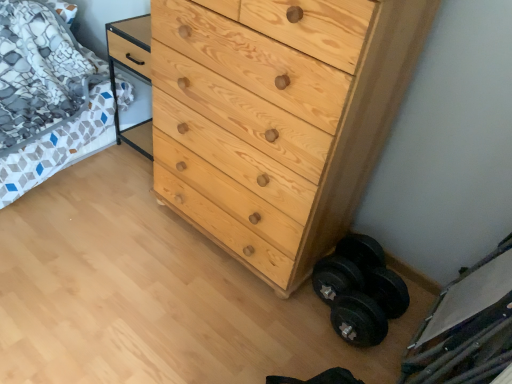
Locate an element on the screen. blank space to the left of natural wood chest of drawers at center is located at coordinates (104, 232).